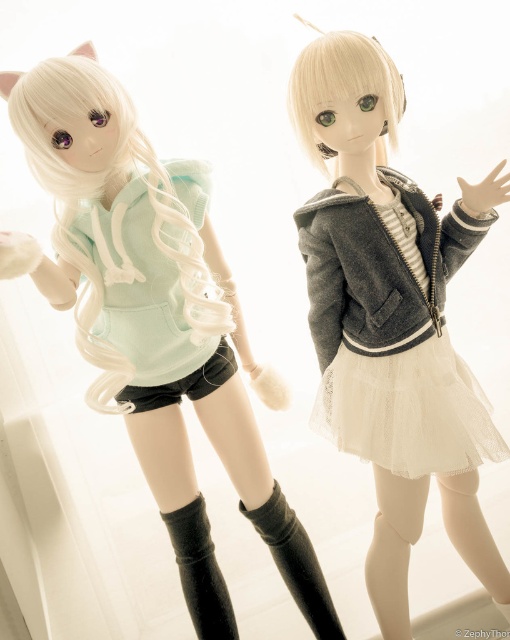
Question: Which point is farther from the camera taking this photo?

Choices:
 (A) (154, 211)
 (B) (313, 627)
 (C) (495, 214)

Answer: (B)

Question: Considering the real-world distances, which object is closest to the black matte sock at lower center?

Choices:
 (A) black knitted boot at lower center
 (B) white lace dress at center
 (C) matte black hoodie at left

Answer: (A)

Question: Can you confirm if black knitted boot at lower center is bigger than black matte sock at lower center?

Choices:
 (A) no
 (B) yes

Answer: (B)

Question: Which point appears closest to the camera in this image?

Choices:
 (A) (168, 362)
 (B) (508, 616)
 (C) (496, 456)
 (D) (446, 477)

Answer: (C)

Question: Does black knitted boot at lower center have a larger size compared to black matte sock at lower center?

Choices:
 (A) yes
 (B) no

Answer: (A)

Question: Can you confirm if satin gray jacket at upper right is thinner than black suede boot at lower center?

Choices:
 (A) yes
 (B) no

Answer: (B)